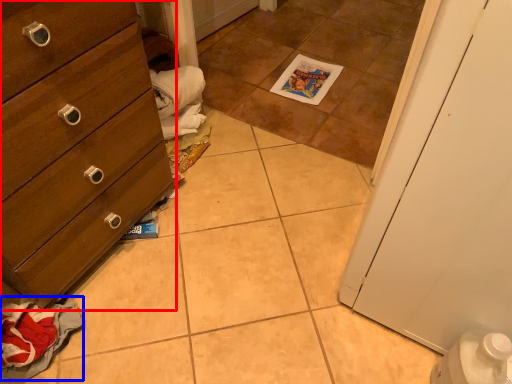
Question: Which object is further to the camera taking this photo, chest of drawers (highlighted by a red box) or material (highlighted by a blue box)?

Choices:
 (A) chest of drawers
 (B) material

Answer: (B)